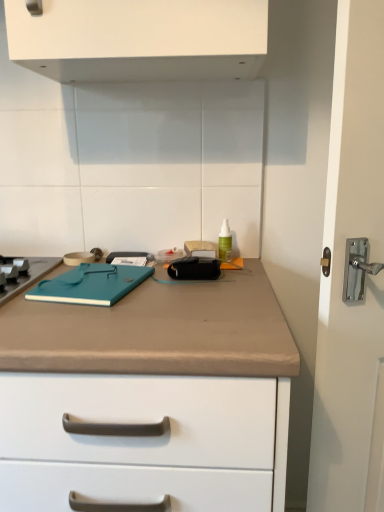
Question: Considering the positions of point (99, 266) and point (64, 308), is point (99, 266) closer or farther from the camera than point (64, 308)?

Choices:
 (A) farther
 (B) closer

Answer: (A)

Question: Visually, is teal matte notebook at center positioned to the left or to the right of beige matte countertop at center?

Choices:
 (A) right
 (B) left

Answer: (A)

Question: Which of these objects is positioned closest to the teal matte notebook at center?

Choices:
 (A) green translucent bottle at center
 (B) beige matte countertop at center

Answer: (B)

Question: Which is nearer to the teal matte notebook at center?

Choices:
 (A) green translucent bottle at center
 (B) beige matte countertop at center

Answer: (B)